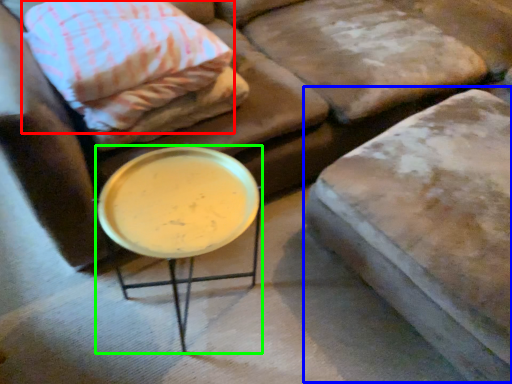
Question: Estimate the real-world distances between objects in this image. Which object is closer to pillow (highlighted by a red box), swivel chair (highlighted by a blue box) or table (highlighted by a green box)?

Choices:
 (A) swivel chair
 (B) table

Answer: (B)